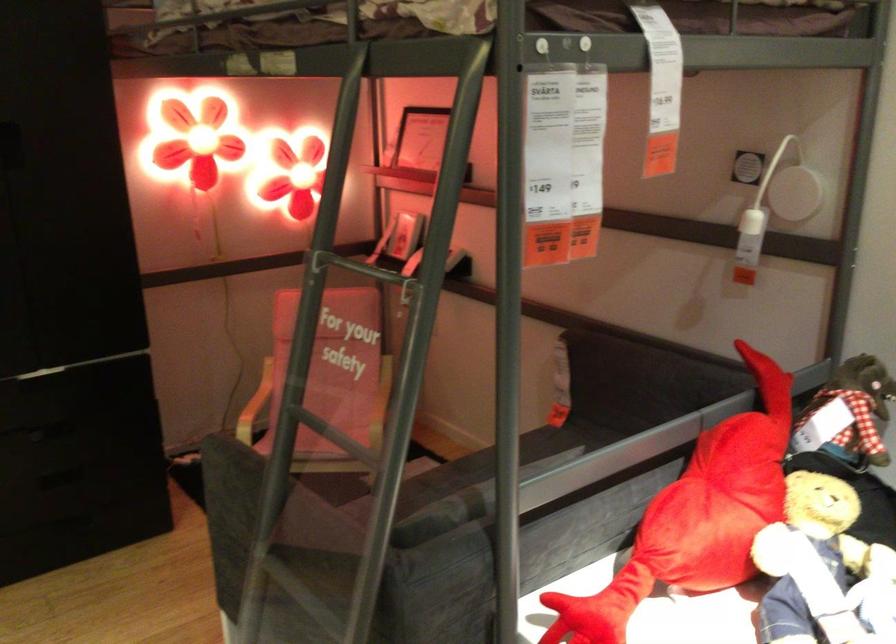
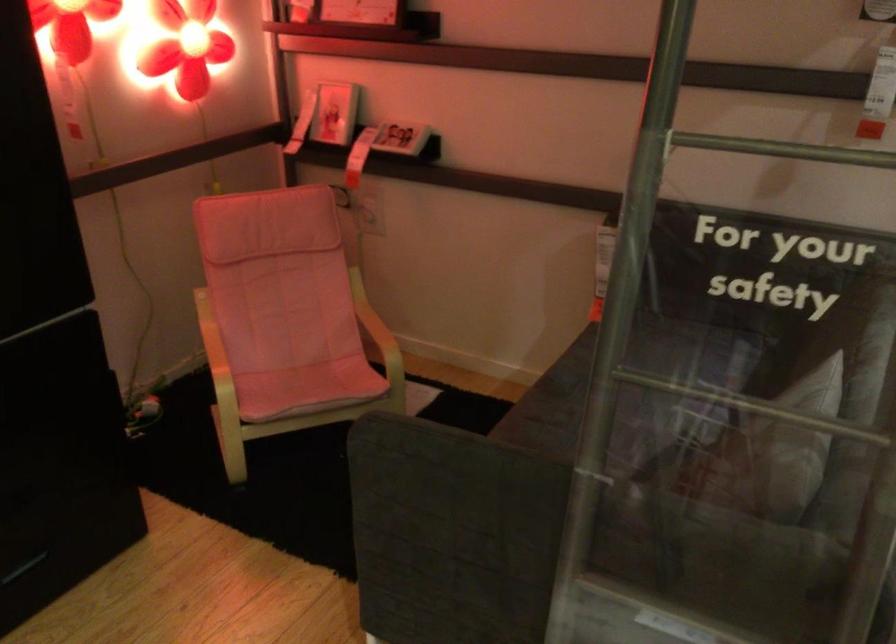
What movement of the cameraman would produce the second image?

The cameraman moved toward left, forward.